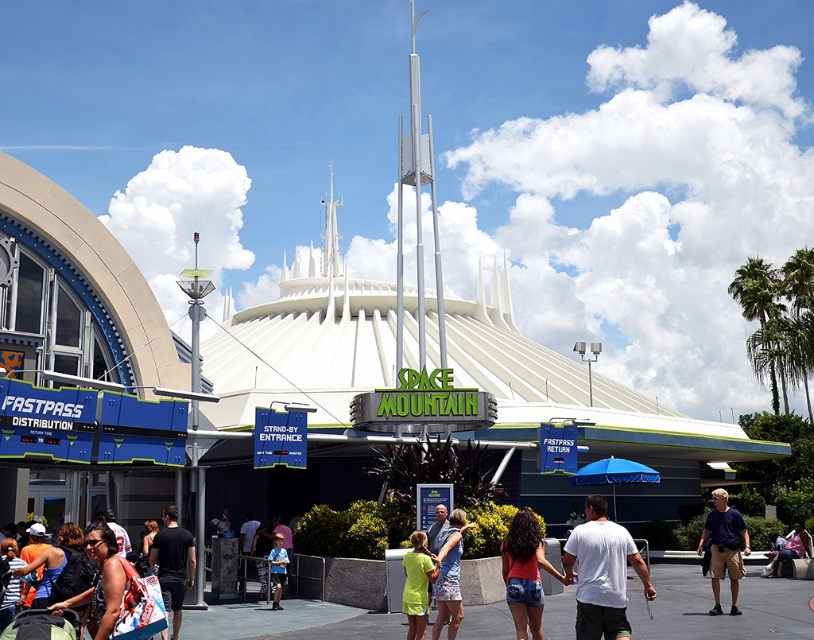
Is green leafy palm tree at upper right shorter than denim shorts at center?

No.

Is green leafy palm tree at upper right to the right of denim shorts at center from the viewer's perspective?

Yes, green leafy palm tree at upper right is to the right of denim shorts at center.

What are the coordinates of `green leafy palm tree at upper right` in the screenshot? It's located at (779, 321).

Can you confirm if green leafy palm tree at upper right is wider than silver metallic spire at center?

Answer: Correct, the width of green leafy palm tree at upper right exceeds that of silver metallic spire at center.

Between green leafy palm tree at upper right and silver metallic spire at center, which one is positioned higher?

silver metallic spire at center is higher up.

Image resolution: width=814 pixels, height=640 pixels. What do you see at coordinates (779, 321) in the screenshot?
I see `green leafy palm tree at upper right` at bounding box center [779, 321].

This screenshot has height=640, width=814. Find the location of `green leafy palm tree at upper right`. green leafy palm tree at upper right is located at coordinates (779, 321).

Is green leafy palm tree at upper right smaller than blue fabric shirt at center?

No.

Between point (795, 275) and point (278, 580), which one is positioned behind?

The point (795, 275) is behind.

Find the location of a particular element. The height and width of the screenshot is (640, 814). green leafy palm tree at upper right is located at coordinates (779, 321).